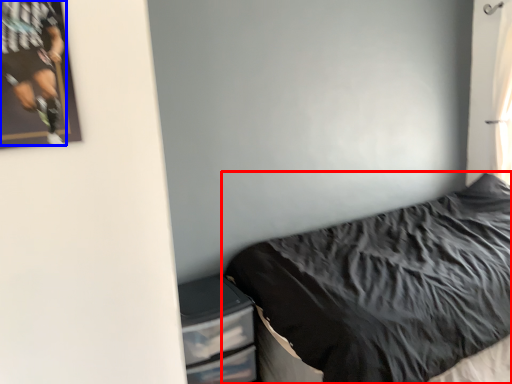
Question: Among these objects, which one is farthest to the camera, bed (highlighted by a red box) or person (highlighted by a blue box)?

Choices:
 (A) bed
 (B) person

Answer: (A)